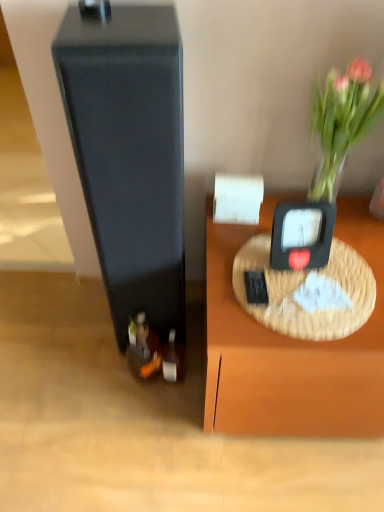
In order to click on free space in front of black plastic weight scale at upper right in this screenshot , I will do `click(302, 313)`.